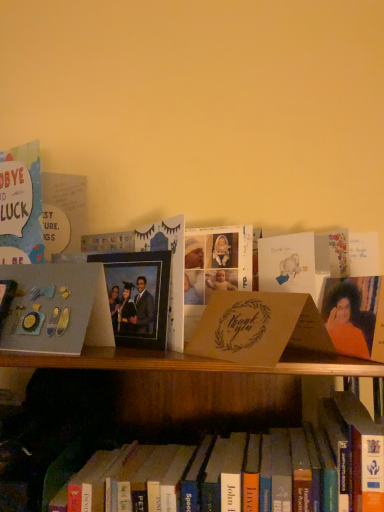
Question: Can we say matte brown card at center, which appears as the first paperback book when viewed from the right, lies outside matte gray paper at left, the 3th paperback book from the right?

Choices:
 (A) yes
 (B) no

Answer: (A)

Question: Are matte brown card at center, the third paperback book positioned from the left, and matte gray paper at left, the 1th paperback book viewed from the left, far apart?

Choices:
 (A) no
 (B) yes

Answer: (A)

Question: Is matte brown card at center, the third paperback book positioned from the left, shorter than matte gray paper at left, the 3th paperback book from the right?

Choices:
 (A) yes
 (B) no

Answer: (A)

Question: Considering the relative sizes of matte brown card at center, the third paperback book positioned from the left, and matte gray paper at left, the 3th paperback book from the right, in the image provided, is matte brown card at center, the third paperback book positioned from the left, wider than matte gray paper at left, the 3th paperback book from the right,?

Choices:
 (A) yes
 (B) no

Answer: (B)

Question: Is matte brown card at center, which appears as the first paperback book when viewed from the right, directly adjacent to matte gray paper at left, the 1th paperback book viewed from the left?

Choices:
 (A) no
 (B) yes

Answer: (A)

Question: Is matte brown card at center, the third paperback book positioned from the left, oriented towards matte gray paper at left, the 1th paperback book viewed from the left?

Choices:
 (A) yes
 (B) no

Answer: (B)

Question: Considering the relative sizes of matte brown card at center, the 2th paperback book when ordered from right to left, and matte brown card at center, which appears as the first paperback book when viewed from the right, in the image provided, is matte brown card at center, the 2th paperback book when ordered from right to left, smaller than matte brown card at center, which appears as the first paperback book when viewed from the right,?

Choices:
 (A) yes
 (B) no

Answer: (B)

Question: Can you confirm if matte brown card at center, placed as the 2th paperback book when sorted from left to right, is bigger than matte brown card at center, which appears as the first paperback book when viewed from the right?

Choices:
 (A) no
 (B) yes

Answer: (B)

Question: Could matte brown card at center, which appears as the first paperback book when viewed from the right, be considered to be inside matte brown card at center, placed as the 2th paperback book when sorted from left to right?

Choices:
 (A) no
 (B) yes

Answer: (A)

Question: Is matte brown card at center, the 2th paperback book when ordered from right to left, not near matte brown card at center, the third paperback book positioned from the left?

Choices:
 (A) no
 (B) yes

Answer: (A)

Question: Is matte brown card at center, placed as the 2th paperback book when sorted from left to right, turned away from matte brown card at center, which appears as the first paperback book when viewed from the right?

Choices:
 (A) yes
 (B) no

Answer: (B)

Question: From a real-world perspective, is matte brown card at center, the 2th paperback book when ordered from right to left, located higher than matte brown card at center, which appears as the first paperback book when viewed from the right?

Choices:
 (A) yes
 (B) no

Answer: (B)

Question: Is matte gray paper at left, the 1th paperback book viewed from the left, far away from matte brown card at center, the third paperback book positioned from the left?

Choices:
 (A) no
 (B) yes

Answer: (A)